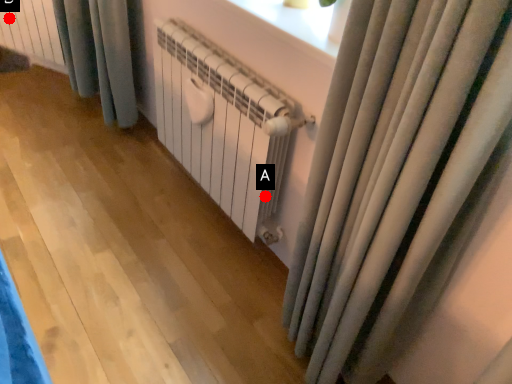
Question: Two points are circled on the image, labeled by A and B beside each circle. Which point is further to the camera?

Choices:
 (A) A is further
 (B) B is further

Answer: (B)